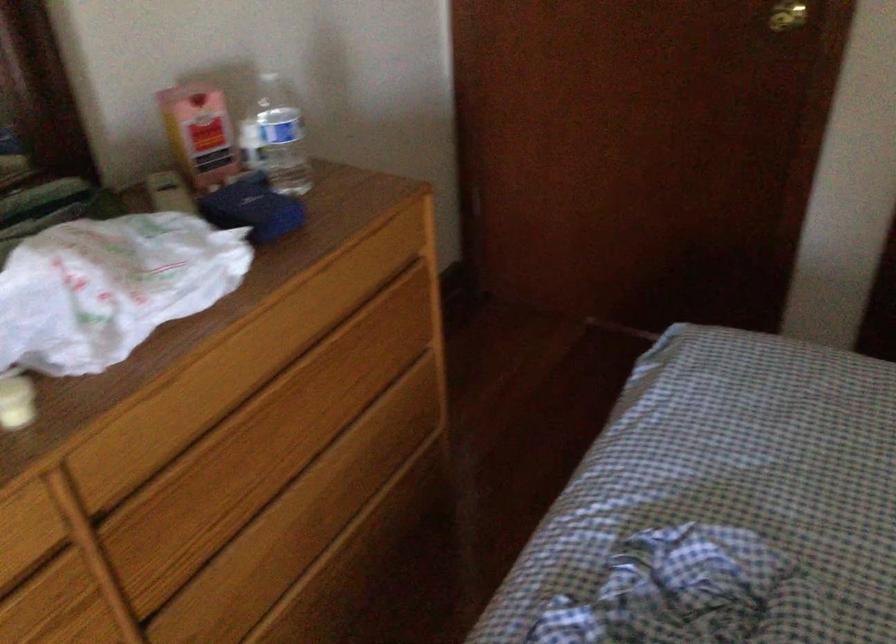
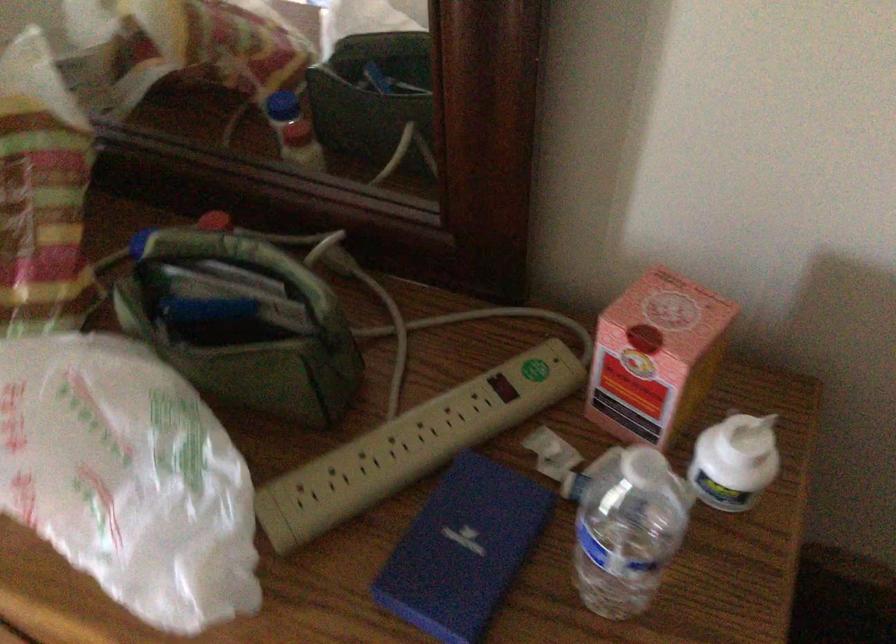
In the second image, find the point that corresponds to (207,106) in the first image.

(656, 357)